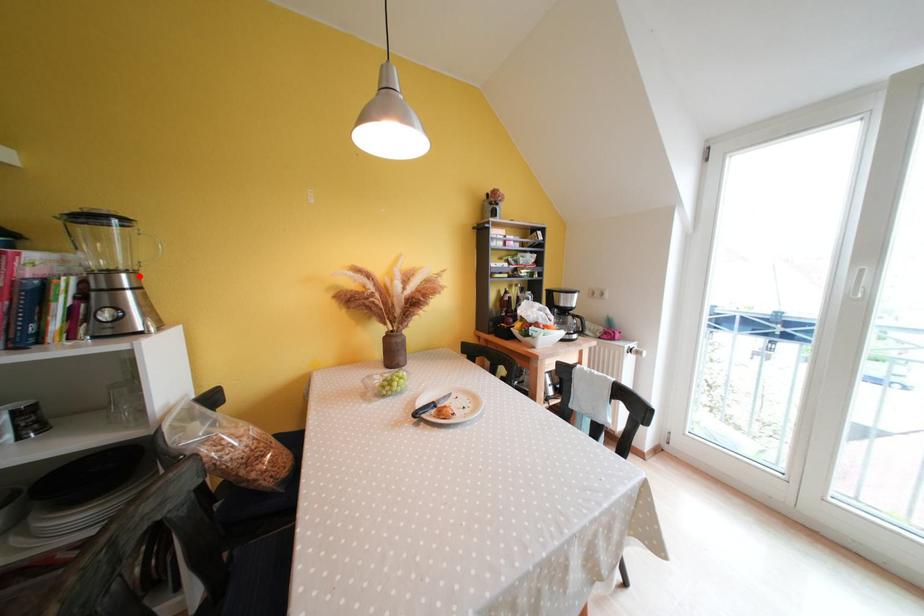
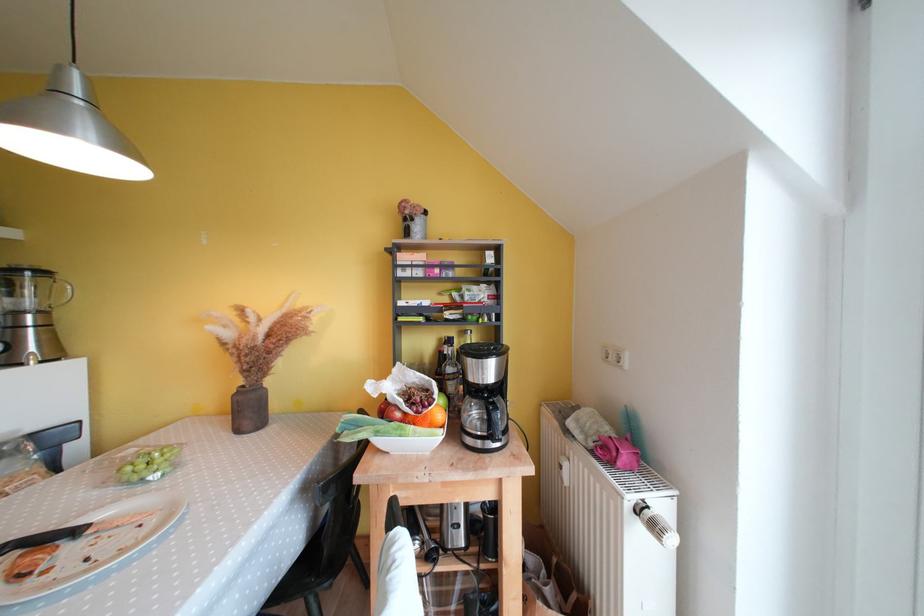
In the second image, find the point that corresponds to the highlighted location in the first image.

(49, 315)